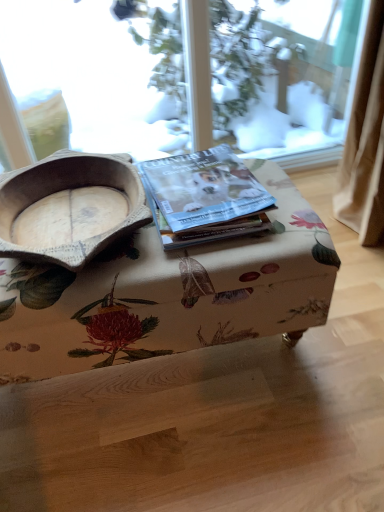
This screenshot has width=384, height=512. I want to click on free space above floral fabric ottoman at center (from a real-world perspective), so click(105, 226).